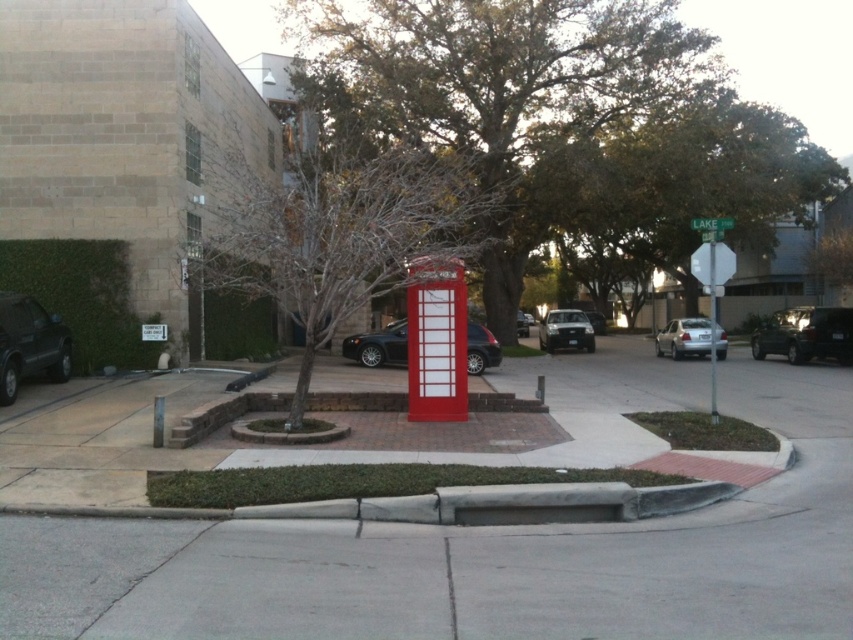
You are a delivery driver who needs to park your car between the silver metallic sedan at right and the satin silver sedan at center. Is there enough space between them to fit your car?

The silver metallic sedan at right is positioned on the left side of the satin silver sedan at center, so there is no space between them to park your car.

You are a delivery person with a cart that is 1.2 meters wide. You need to move from the red brick pavement at center to the bare wood tree at center. Is there enough space between them for your cart to pass through?

The distance between the red brick pavement at center and the bare wood tree at center is 8.15 meters, which is more than enough space for your 1.2 meter wide cart to pass through safely.